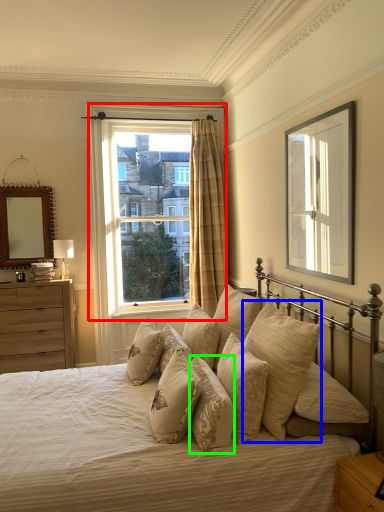
Question: Based on their relative distances, which object is farther from window (highlighted by a red box)? Choose from pillow (highlighted by a blue box) and pillow (highlighted by a green box).

Choices:
 (A) pillow
 (B) pillow

Answer: (B)